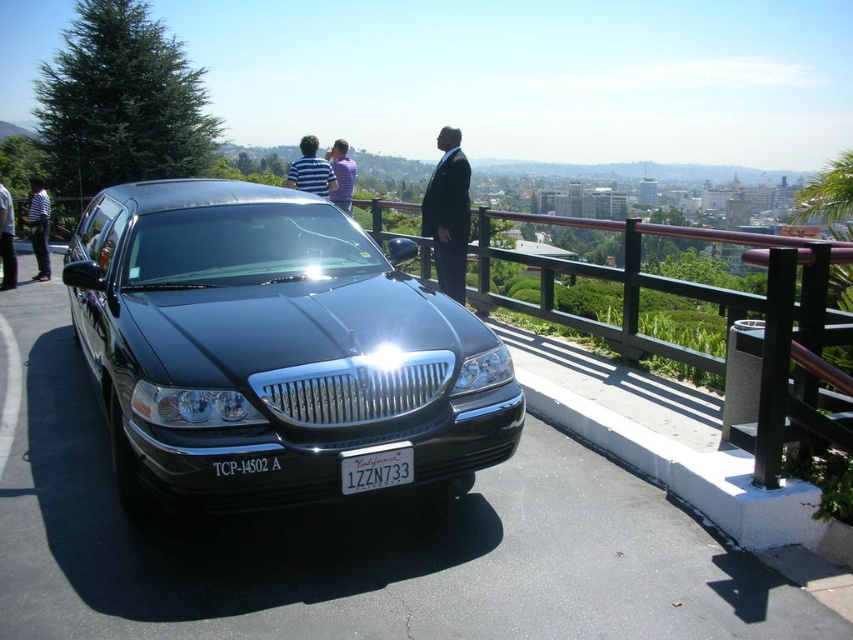
How far apart are dark suit at center and dark gray suit at center?

The distance of dark suit at center from dark gray suit at center is 7.65 meters.

Between point (438, 260) and point (4, 250), which one is positioned behind?

The point (4, 250) is behind.

Which is in front, point (460, 225) or point (4, 280)?

Point (460, 225) is more forward.

You are a GUI agent. You are given a task and a screenshot of the screen. Output one action in this format:
    pyautogui.click(x=<x>, y=<y>)
    Task: Click on the dark suit at center
    The height and width of the screenshot is (640, 853).
    Given the screenshot: What is the action you would take?
    pyautogui.click(x=448, y=212)

Does point (148, 444) come in front of point (355, 170)?

Yes, point (148, 444) is closer to viewer.

Is point (198, 397) closer to camera compared to point (335, 204)?

Yes, point (198, 397) is closer to viewer.

I want to click on black metallic car at center, so [271, 348].

Is point (109, 259) behind point (347, 458)?

Yes, it is behind point (347, 458).

How far apart are black metallic car at center and white plastic license plate at center?

4.37 feet

Where is `black metallic car at center`? The image size is (853, 640). black metallic car at center is located at coordinates (271, 348).